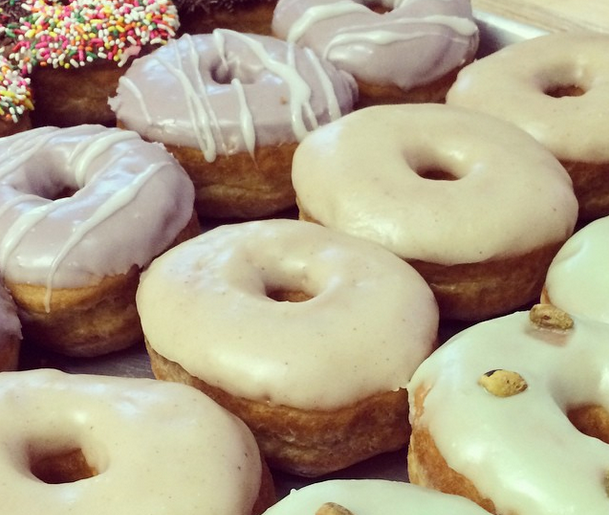
Locate an element on the screen. stainless steel metal baking tray is located at coordinates (132, 365).